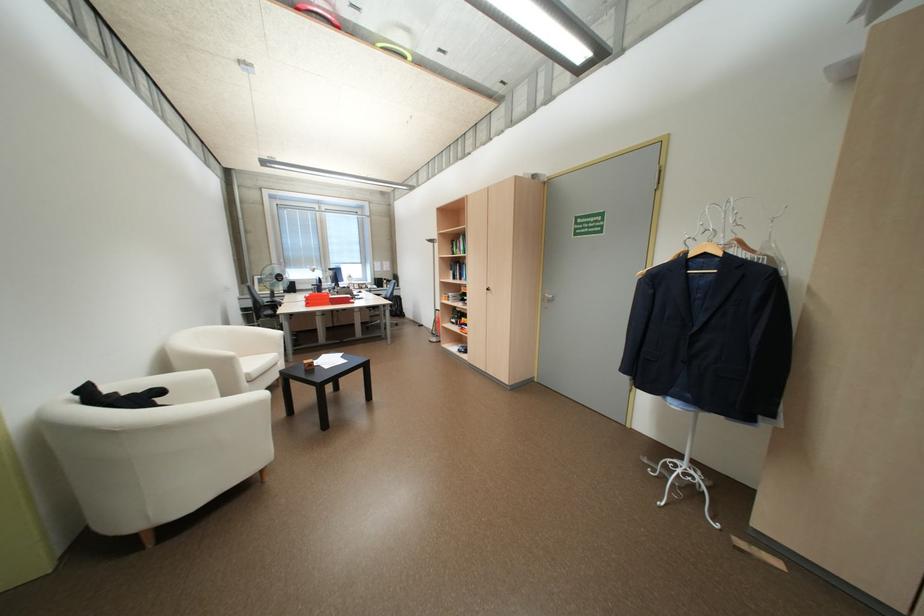
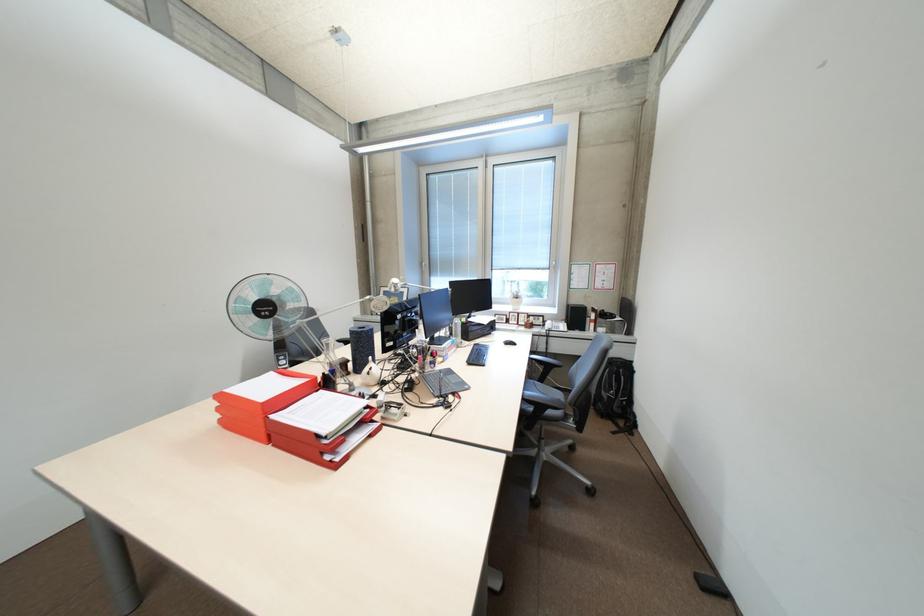
Where in the second image is the point corresponding to [317,305] from the first image?

(231, 421)